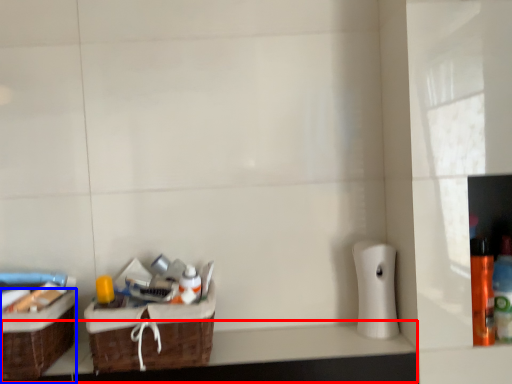
Question: Among these objects, which one is farthest to the camera, counter top (highlighted by a red box) or box (highlighted by a blue box)?

Choices:
 (A) counter top
 (B) box

Answer: (A)